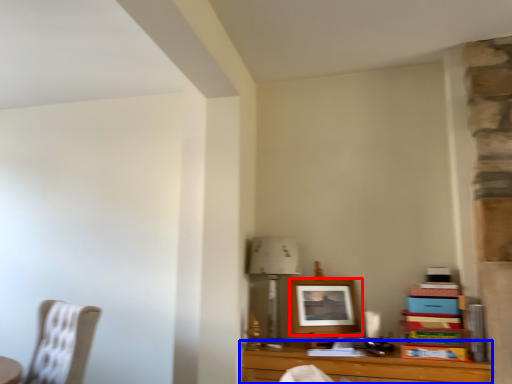
Question: Which point is closer to the camera, picture frame (highlighted by a red box) or table (highlighted by a blue box)?

Choices:
 (A) picture frame
 (B) table

Answer: (B)